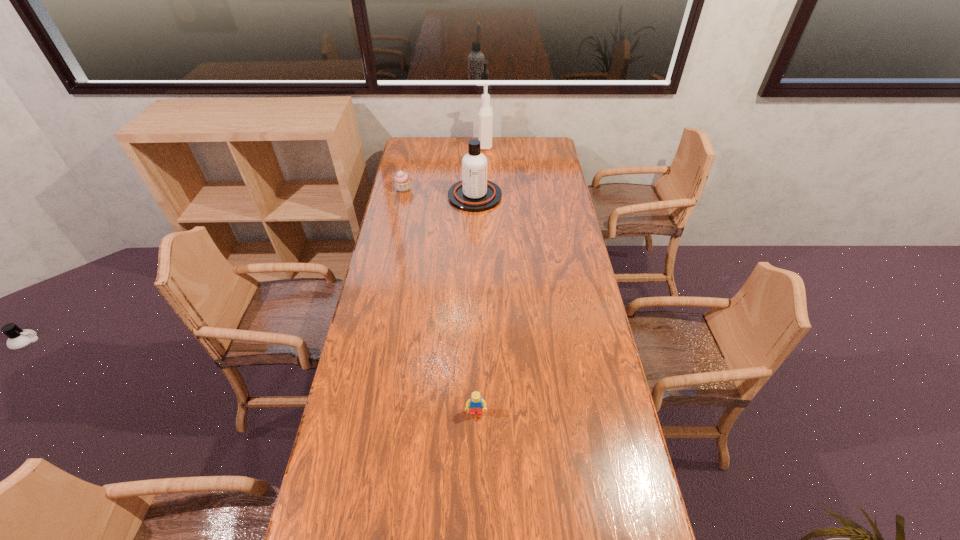
Where is `vacant region that satisfies the following two spatial constraints: 1. on the front label of the farthest object; 2. on the front-facing side of the Lego`? The height and width of the screenshot is (540, 960). vacant region that satisfies the following two spatial constraints: 1. on the front label of the farthest object; 2. on the front-facing side of the Lego is located at coordinates (489, 413).